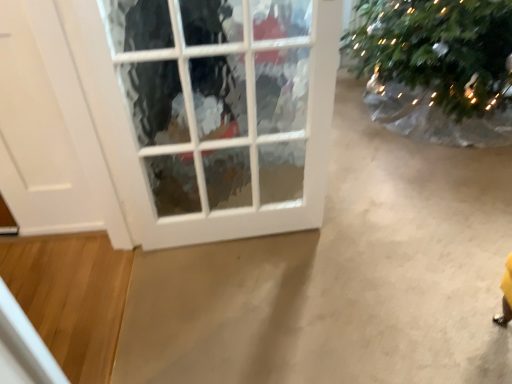
This screenshot has height=384, width=512. I want to click on free space in front of white glass window at center, so click(234, 315).